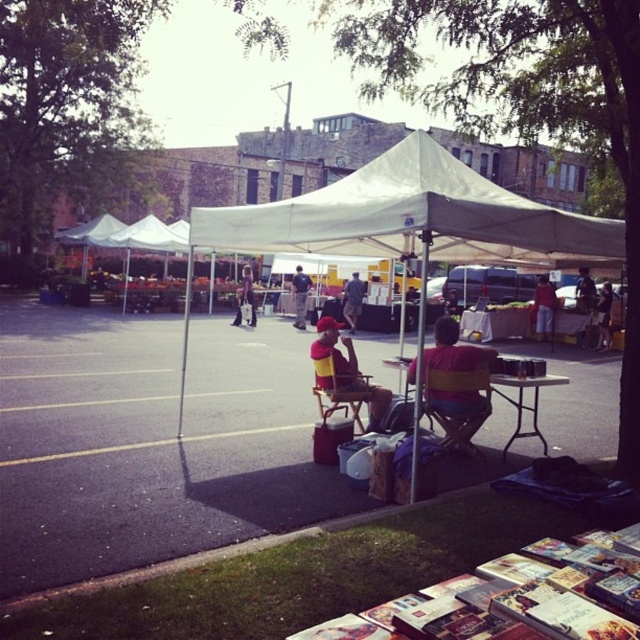
Question: Which point is closer to the camera taking this photo?

Choices:
 (A) (536, 316)
 (B) (298, 275)

Answer: (A)

Question: Is white fabric canopy at center above camouflage pants at center?

Choices:
 (A) no
 (B) yes

Answer: (B)

Question: Estimate the real-world distances between objects in this image. Which object is closer to the smooth black shirt at center?

Choices:
 (A) smooth leather jacket at center
 (B) camouflage pants at center
 (C) white fabric tent at center
 (D) camouflage fabric jacket at center

Answer: (A)

Question: Can you confirm if wooden folding chair at center is wider than matte red shirt at center?

Choices:
 (A) no
 (B) yes

Answer: (B)

Question: Estimate the real-world distances between objects in this image. Which object is closer to the matte black bag at center?

Choices:
 (A) yellow and red striped shirt at center
 (B) camouflage fabric jacket at center
 (C) yellow fabric chair at center

Answer: (B)

Question: Is white fabric canopy at center above camouflage pants at center?

Choices:
 (A) yes
 (B) no

Answer: (A)